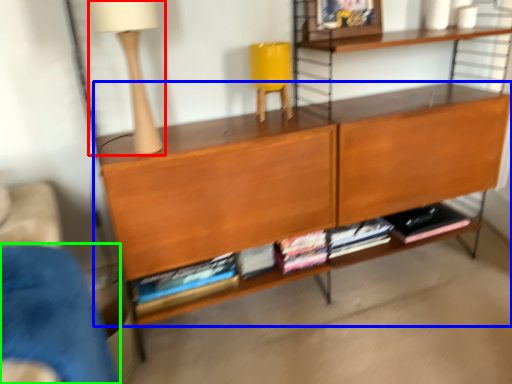
Question: Which is nearer to the table lamp (highlighted by a red box)? shelf (highlighted by a blue box) or armchair (highlighted by a green box).

Choices:
 (A) shelf
 (B) armchair

Answer: (A)